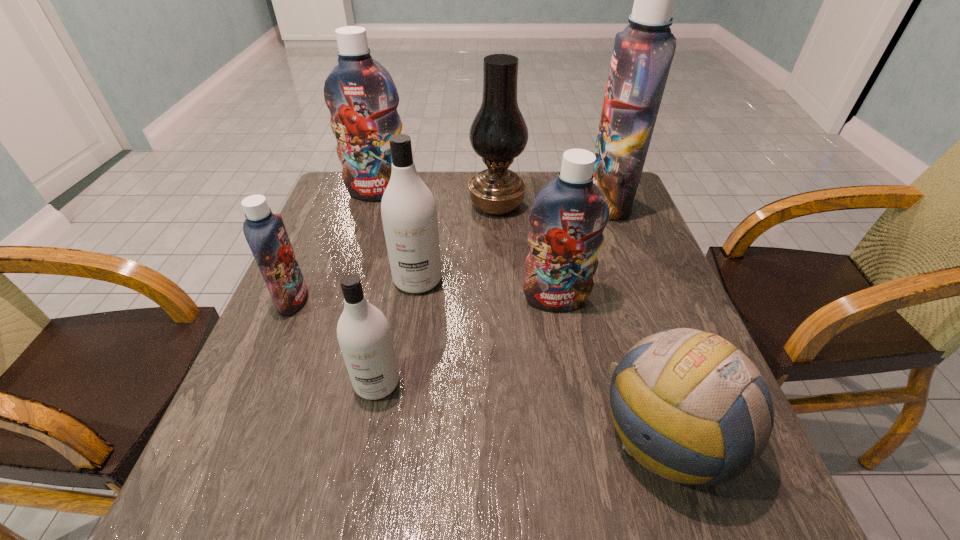
I want to click on vacant space located on the left of the volleyball, so 491,435.

You are a GUI agent. You are given a task and a screenshot of the screen. Output one action in this format:
    pyautogui.click(x=<x>, y=<y>)
    Task: Click on the oil lamp at the far edge
    The width and height of the screenshot is (960, 540).
    Given the screenshot: What is the action you would take?
    pyautogui.click(x=498, y=133)

Where is `object present at the near edge`? This screenshot has width=960, height=540. object present at the near edge is located at coordinates (689, 406).

Where is `shampoo that is positioned at the right edge`? Image resolution: width=960 pixels, height=540 pixels. shampoo that is positioned at the right edge is located at coordinates (642, 55).

Where is `volleyball at the right edge`? volleyball at the right edge is located at coordinates (689, 406).

Where is `object that is at the far left corner`? object that is at the far left corner is located at coordinates (360, 93).

Identify the location of object that is at the far right corner. This screenshot has height=540, width=960. (642, 55).

Where is `object situated at the near right corner`? This screenshot has height=540, width=960. object situated at the near right corner is located at coordinates (689, 406).

Locate an element on the screen. This screenshot has width=960, height=540. blank space at the far edge is located at coordinates (454, 191).

At what (x,y) coordinates should I click in order to perform the action: click on vacant space at the near edge. Please return your answer as a coordinate pair (x, y). Looking at the image, I should click on (352, 498).